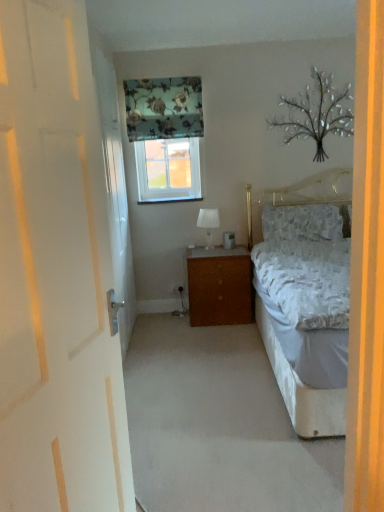
Question: Is metallic silver tree at upper right touching white fabric lampshade at center?

Choices:
 (A) no
 (B) yes

Answer: (A)

Question: Considering the relative sizes of metallic silver tree at upper right and white fabric lampshade at center in the image provided, is metallic silver tree at upper right bigger than white fabric lampshade at center?

Choices:
 (A) no
 (B) yes

Answer: (B)

Question: Are metallic silver tree at upper right and white fabric lampshade at center far apart?

Choices:
 (A) yes
 (B) no

Answer: (A)

Question: From a real-world perspective, is metallic silver tree at upper right on white fabric lampshade at center?

Choices:
 (A) no
 (B) yes

Answer: (B)

Question: Considering the relative sizes of metallic silver tree at upper right and white fabric lampshade at center in the image provided, is metallic silver tree at upper right smaller than white fabric lampshade at center?

Choices:
 (A) yes
 (B) no

Answer: (B)

Question: Considering the positions of metallic silver tree at upper right and clear glass window at upper center in the image, is metallic silver tree at upper right wider or thinner than clear glass window at upper center?

Choices:
 (A) thin
 (B) wide

Answer: (A)

Question: From the image's perspective, is metallic silver tree at upper right located above or below clear glass window at upper center?

Choices:
 (A) above
 (B) below

Answer: (A)

Question: Considering the positions of point (322, 116) and point (147, 193), is point (322, 116) closer or farther from the camera than point (147, 193)?

Choices:
 (A) closer
 (B) farther

Answer: (A)

Question: Is metallic silver tree at upper right taller or shorter than clear glass window at upper center?

Choices:
 (A) tall
 (B) short

Answer: (A)

Question: Is point (168, 192) positioned closer to the camera than point (144, 99)?

Choices:
 (A) farther
 (B) closer

Answer: (A)

Question: Considering their positions, is clear glass window at upper center located in front of or behind floral fabric curtain at upper center?

Choices:
 (A) front
 (B) behind

Answer: (B)

Question: From the image's perspective, is clear glass window at upper center positioned above or below floral fabric curtain at upper center?

Choices:
 (A) above
 (B) below

Answer: (B)

Question: Considering the positions of clear glass window at upper center and floral fabric curtain at upper center in the image, is clear glass window at upper center bigger or smaller than floral fabric curtain at upper center?

Choices:
 (A) small
 (B) big

Answer: (A)

Question: Choose the correct answer: Is fluffy white pillow at center inside white wooden door at left or outside it?

Choices:
 (A) inside
 (B) outside

Answer: (B)

Question: In terms of height, does fluffy white pillow at center look taller or shorter compared to white wooden door at left?

Choices:
 (A) tall
 (B) short

Answer: (B)